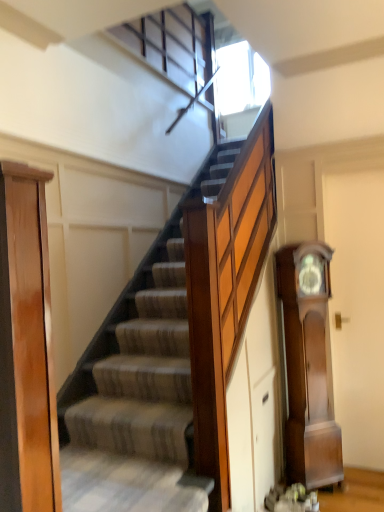
The width and height of the screenshot is (384, 512). What do you see at coordinates (26, 347) in the screenshot?
I see `light brown wood door at left` at bounding box center [26, 347].

What is the approximate width of light brown wood door at left?

The width of light brown wood door at left is 5.87 inches.

Find the location of a particular element. The width and height of the screenshot is (384, 512). light brown wood door at left is located at coordinates (26, 347).

Measure the distance between polished wood grandfather clock at right and camera.

polished wood grandfather clock at right and camera are 8.37 feet apart from each other.

This screenshot has height=512, width=384. Describe the element at coordinates (308, 365) in the screenshot. I see `polished wood grandfather clock at right` at that location.

At what (x,y) coordinates should I click in order to perform the action: click on polished wood grandfather clock at right. Please return your answer as a coordinate pair (x, y). The height and width of the screenshot is (512, 384). Looking at the image, I should click on (308, 365).

Locate an element on the screen. The height and width of the screenshot is (512, 384). light brown wood door at left is located at coordinates (26, 347).

Is polished wood grandfather clock at right at the left side of light brown wood door at left?

Incorrect, polished wood grandfather clock at right is not on the left side of light brown wood door at left.

Considering the relative positions of polished wood grandfather clock at right and light brown wood door at left in the image provided, is polished wood grandfather clock at right in front of light brown wood door at left?

No, the depth of polished wood grandfather clock at right is greater than that of light brown wood door at left.

Between point (322, 479) and point (48, 275), which one is positioned in front?

The point (48, 275) is more forward.

From the image's perspective, who appears lower, polished wood grandfather clock at right or light brown wood door at left?

polished wood grandfather clock at right.

From a real-world perspective, is polished wood grandfather clock at right positioned under light brown wood door at left based on gravity?

Yes, from a real-world perspective, polished wood grandfather clock at right is under light brown wood door at left.

Looking at their sizes, would you say polished wood grandfather clock at right is wider or thinner than light brown wood door at left?

In the image, polished wood grandfather clock at right appears to be wider than light brown wood door at left.

Is polished wood grandfather clock at right taller or shorter than light brown wood door at left?

Considering their sizes, polished wood grandfather clock at right has more height than light brown wood door at left.

Considering the relative sizes of polished wood grandfather clock at right and light brown wood door at left in the image provided, is polished wood grandfather clock at right smaller than light brown wood door at left?

No.

Is polished wood grandfather clock at right inside the boundaries of light brown wood door at left, or outside?

The correct answer is: outside.

Is polished wood grandfather clock at right far away from light brown wood door at left?

That's right, there is a large distance between polished wood grandfather clock at right and light brown wood door at left.

Could you tell me if polished wood grandfather clock at right is turned towards light brown wood door at left?

No, polished wood grandfather clock at right is not oriented towards light brown wood door at left.

How distant is polished wood grandfather clock at right from light brown wood door at left?

polished wood grandfather clock at right is 1.95 meters away from light brown wood door at left.

Locate an element on the screen. clock located on the right of light brown wood door at left is located at coordinates (308, 365).

Which is more to the left, light brown wood door at left or polished wood grandfather clock at right?

light brown wood door at left.

In the scene shown: Is light brown wood door at left in front of or behind polished wood grandfather clock at right in the image?

Visually, light brown wood door at left is located in front of polished wood grandfather clock at right.

Is point (18, 438) less distant than point (318, 358)?

Yes, it is.

From the image's perspective, would you say light brown wood door at left is shown under polished wood grandfather clock at right?

No, from the image's perspective, light brown wood door at left is not beneath polished wood grandfather clock at right.

From a real-world perspective, is light brown wood door at left on polished wood grandfather clock at right?

Correct, in the physical world, light brown wood door at left is higher than polished wood grandfather clock at right.

Can you confirm if light brown wood door at left is thinner than polished wood grandfather clock at right?

Yes, light brown wood door at left is thinner than polished wood grandfather clock at right.

Does light brown wood door at left have a lesser height compared to polished wood grandfather clock at right?

Yes, light brown wood door at left is shorter than polished wood grandfather clock at right.

Considering the sizes of light brown wood door at left and polished wood grandfather clock at right in the image, is light brown wood door at left bigger or smaller than polished wood grandfather clock at right?

In the image, light brown wood door at left appears to be smaller than polished wood grandfather clock at right.

Is light brown wood door at left not within polished wood grandfather clock at right?

Yes, light brown wood door at left is outside of polished wood grandfather clock at right.

Is light brown wood door at left not near polished wood grandfather clock at right?

light brown wood door at left is far away from polished wood grandfather clock at right.

Does light brown wood door at left turn towards polished wood grandfather clock at right?

Yes, light brown wood door at left faces towards polished wood grandfather clock at right.

How distant is light brown wood door at left from polished wood grandfather clock at right?

A distance of 1.95 meters exists between light brown wood door at left and polished wood grandfather clock at right.

You are a GUI agent. You are given a task and a screenshot of the screen. Output one action in this format:
    pyautogui.click(x=<x>, y=<y>)
    Task: Click on the door on the left of the polished wood grandfather clock at right
    
    Given the screenshot: What is the action you would take?
    pyautogui.click(x=26, y=347)

Image resolution: width=384 pixels, height=512 pixels. Identify the location of clock located underneath the light brown wood door at left (from a real-world perspective). (308, 365).

The width and height of the screenshot is (384, 512). In order to click on door that is above the polished wood grandfather clock at right (from a real-world perspective) in this screenshot , I will do `click(26, 347)`.